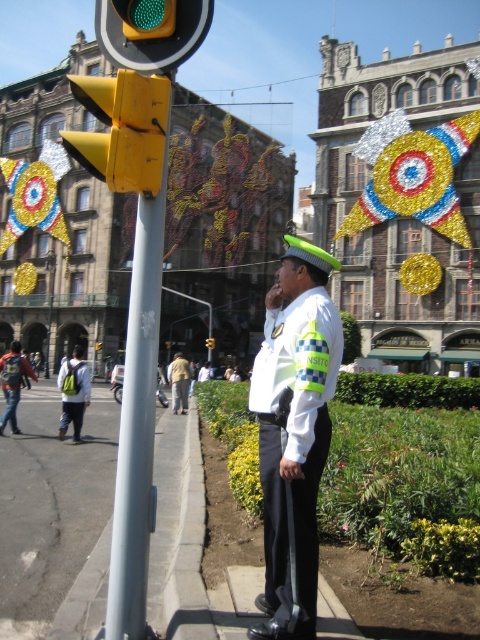
Between light gray backpack at left and yellow plastic traffic light at upper left, which one appears on the right side from the viewer's perspective?

From the viewer's perspective, yellow plastic traffic light at upper left appears more on the right side.

Does light gray backpack at left appear under yellow plastic traffic light at upper left?

Correct, light gray backpack at left is located below yellow plastic traffic light at upper left.

Identify the location of light gray backpack at left. (73, 392).

This screenshot has width=480, height=640. What are the coordinates of `light gray backpack at left` in the screenshot? It's located at (73, 392).

How far apart are green glass traffic light at upper center and denim jacket at left?

The distance of green glass traffic light at upper center from denim jacket at left is 45.22 meters.

Which is more to the right, green glass traffic light at upper center or denim jacket at left?

From the viewer's perspective, green glass traffic light at upper center appears more on the right side.

Who is more distant from viewer, (105, 1) or (21, 362)?

The point (21, 362) is more distant.

Locate an element on the screen. The height and width of the screenshot is (640, 480). green glass traffic light at upper center is located at coordinates (151, 32).

Where is `yellow matte traffic light at left`? This screenshot has width=480, height=640. yellow matte traffic light at left is located at coordinates (122, 129).

Between yellow matte traffic light at left and light gray backpack at left, which one appears on the right side from the viewer's perspective?

yellow matte traffic light at left is more to the right.

Between point (108, 81) and point (66, 413), which one is positioned in front?

Point (108, 81)

Find the location of `yellow matte traffic light at left`. yellow matte traffic light at left is located at coordinates (122, 129).